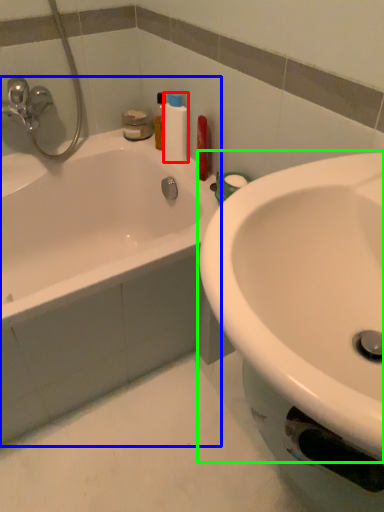
Question: Which object is the closest to the cleaning product (highlighted by a red box)? Choose among these: bathtub (highlighted by a blue box) or sink (highlighted by a green box).

Choices:
 (A) bathtub
 (B) sink

Answer: (A)